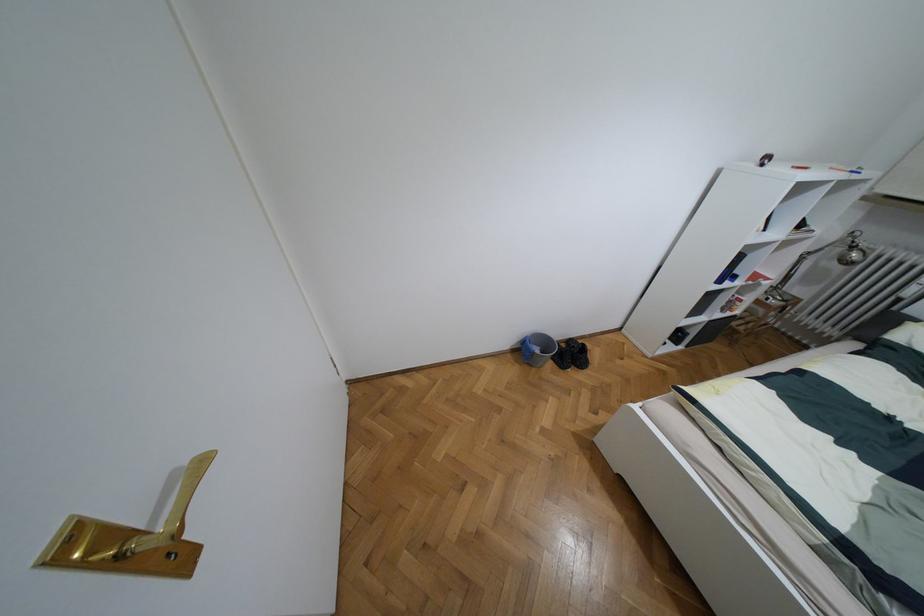
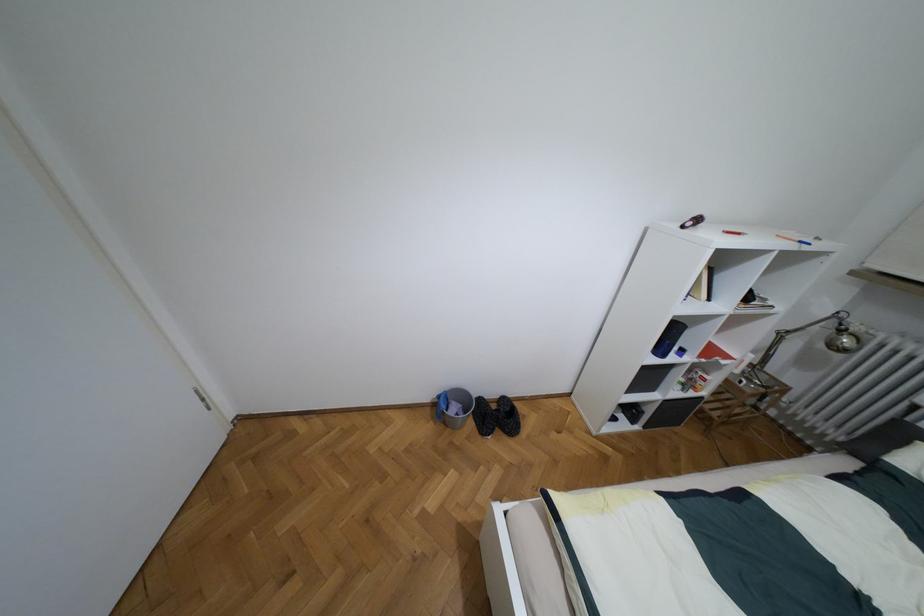
The point at (536, 350) is marked in the first image. Where is the corresponding point in the second image?

(453, 408)